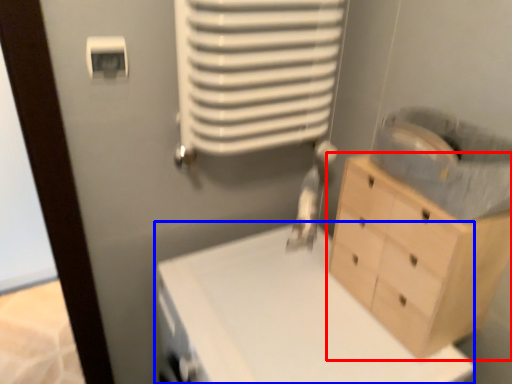
Question: Which object appears farthest to the camera in this image, chest of drawers (highlighted by a red box) or changing table (highlighted by a blue box)?

Choices:
 (A) chest of drawers
 (B) changing table

Answer: (A)